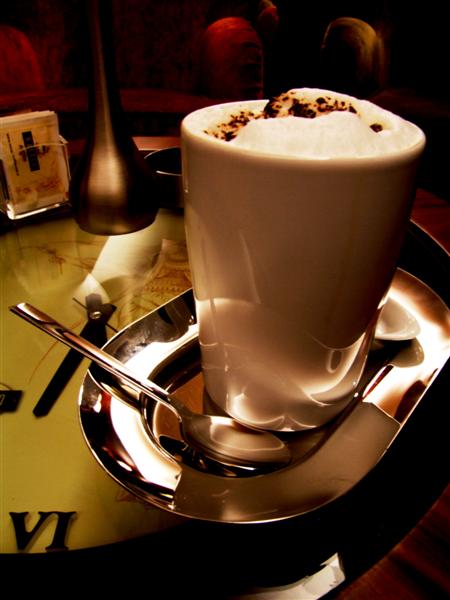
Find the location of a particular element. white mug is located at coordinates (318, 242).